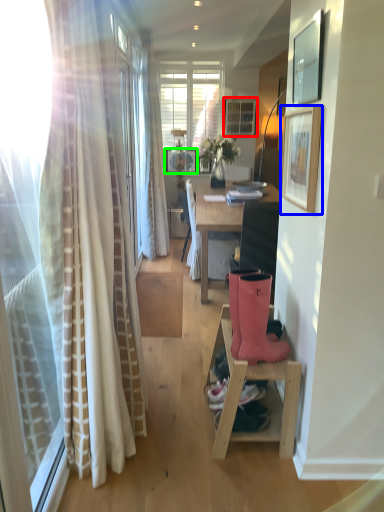
Question: Estimate the real-world distances between objects in this image. Which object is closer to picture frame (highlighted by a red box), picture frame (highlighted by a blue box) or picture frame (highlighted by a green box)?

Choices:
 (A) picture frame
 (B) picture frame

Answer: (B)